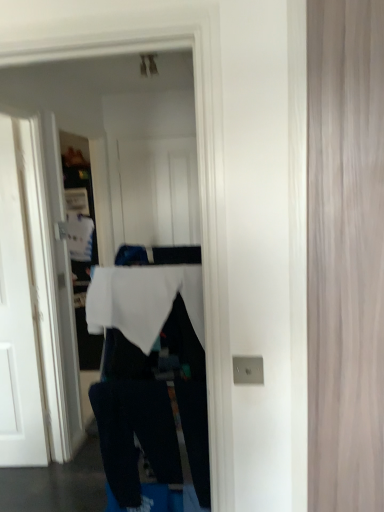
Question: From a real-world perspective, is white matte tablecloth at center located higher than white fabric at center?

Choices:
 (A) yes
 (B) no

Answer: (A)

Question: Does white matte tablecloth at center have a lesser height compared to white fabric at center?

Choices:
 (A) no
 (B) yes

Answer: (B)

Question: Is white matte tablecloth at center not close to white fabric at center?

Choices:
 (A) yes
 (B) no

Answer: (B)

Question: Considering the relative sizes of white matte tablecloth at center and white fabric at center in the image provided, is white matte tablecloth at center wider than white fabric at center?

Choices:
 (A) no
 (B) yes

Answer: (A)

Question: Does white matte tablecloth at center have a larger size compared to white fabric at center?

Choices:
 (A) no
 (B) yes

Answer: (A)

Question: Is white painted wood door at left taller or shorter than wooden door at right?

Choices:
 (A) tall
 (B) short

Answer: (A)

Question: Considering their positions, is white painted wood door at left located in front of or behind wooden door at right?

Choices:
 (A) front
 (B) behind

Answer: (B)

Question: Do you think white painted wood door at left is within wooden door at right, or outside of it?

Choices:
 (A) outside
 (B) inside

Answer: (A)

Question: From the image's perspective, relative to wooden door at right, is white painted wood door at left above or below?

Choices:
 (A) above
 (B) below

Answer: (B)

Question: Is dark blue cotton trousers at lower center spatially inside white painted wood door at left, or outside of it?

Choices:
 (A) inside
 (B) outside

Answer: (B)

Question: Would you say dark blue cotton trousers at lower center is to the left or to the right of white painted wood door at left in the picture?

Choices:
 (A) right
 (B) left

Answer: (A)

Question: From the image's perspective, is dark blue cotton trousers at lower center located above or below white painted wood door at left?

Choices:
 (A) above
 (B) below

Answer: (B)

Question: Is dark blue cotton trousers at lower center wider or thinner than white painted wood door at left?

Choices:
 (A) wide
 (B) thin

Answer: (A)

Question: Choose the correct answer: Is white fabric at center inside white painted wood door at left or outside it?

Choices:
 (A) inside
 (B) outside

Answer: (B)

Question: In terms of size, does white fabric at center appear bigger or smaller than white painted wood door at left?

Choices:
 (A) big
 (B) small

Answer: (A)